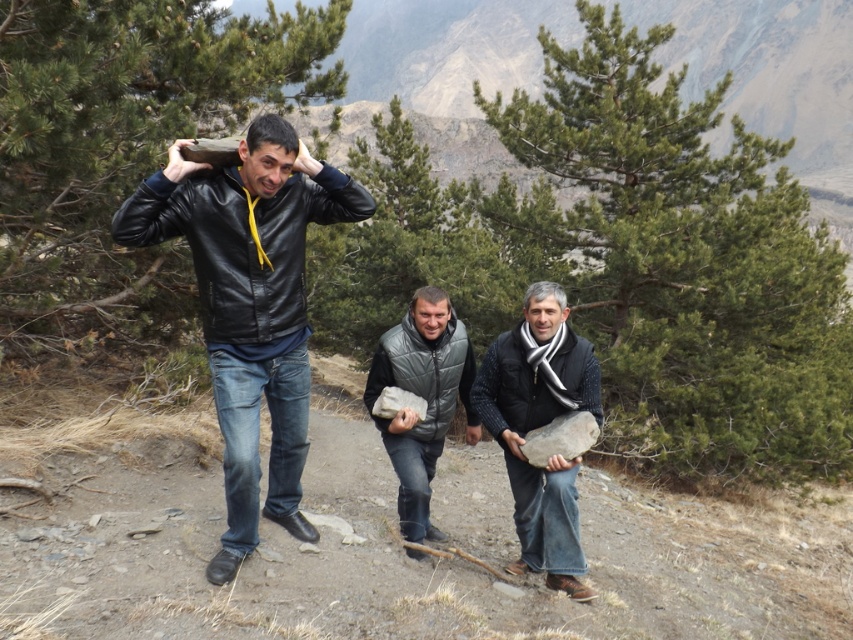
You are standing at the origin point of the image. Which of the two points, point (312, 202) or point (460, 346), is closer to you?

Point (312, 202) is closer to the viewer than point (460, 346).

From the picture: You are a photographer trying to capture a group photo of the black leather jacket at center and the gray matte vest at center. If you want to ensure both subjects are fully visible in the frame, which one should you focus on first?

Since the black leather jacket at center is taller than the gray matte vest at center, you should focus on the black leather jacket at center first to ensure it fits entirely within the frame.

You are standing at the position of the person with the black leather jacket at center. You want to throw a small stone to the person on the left. The distance between you and them is 14.76 feet. Is the distance enough for you to accurately throw the stone?

The distance between the black leather jacket at center and the person on the left is 14.76 feet. Since the average throwing distance for a small stone is around 20 feet, you might struggle to accurately throw it that far, but it is possible with effort.